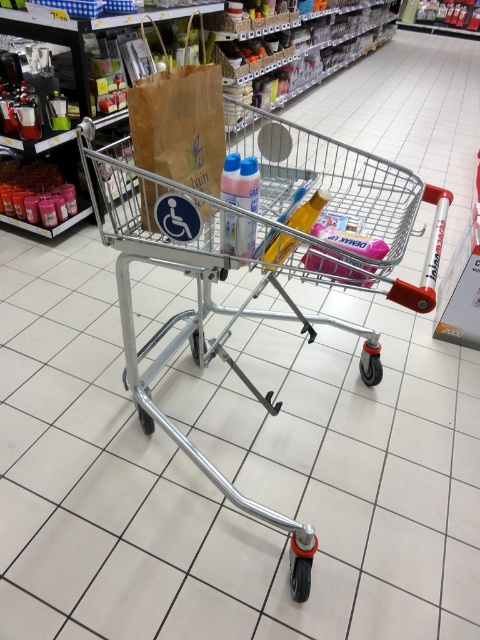
You are standing in the supermarket aisle looking at the shopping cart. There are two points marked in the cart. Which point, point (191, 195) or point (146, 125), is closer to you?

Point (191, 195) is closer to the viewer than point (146, 125).

You are trying to determine if the brown paper bag at center can fit inside the silver metallic trolley at center. Based on their sizes, will it fit?

The silver metallic trolley at center is bigger than brown paper bag at center, so yes, the brown paper bag at center can fit inside the silver metallic trolley at center.

You are a delivery person trying to place a new item into the silver metallic trolley at center. The item is as wide as the brown paper bag at center. Will the item fit inside the trolley?

The silver metallic trolley at center is wider than the brown paper bag at center, so the item with the same width as the brown paper bag at center will fit inside the trolley.